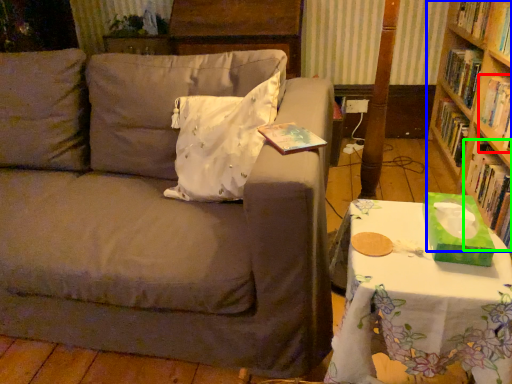
Question: Which object is the farthest from book (highlighted by a red box)? Choose among these: bookcase (highlighted by a blue box) or book (highlighted by a green box).

Choices:
 (A) bookcase
 (B) book

Answer: (A)